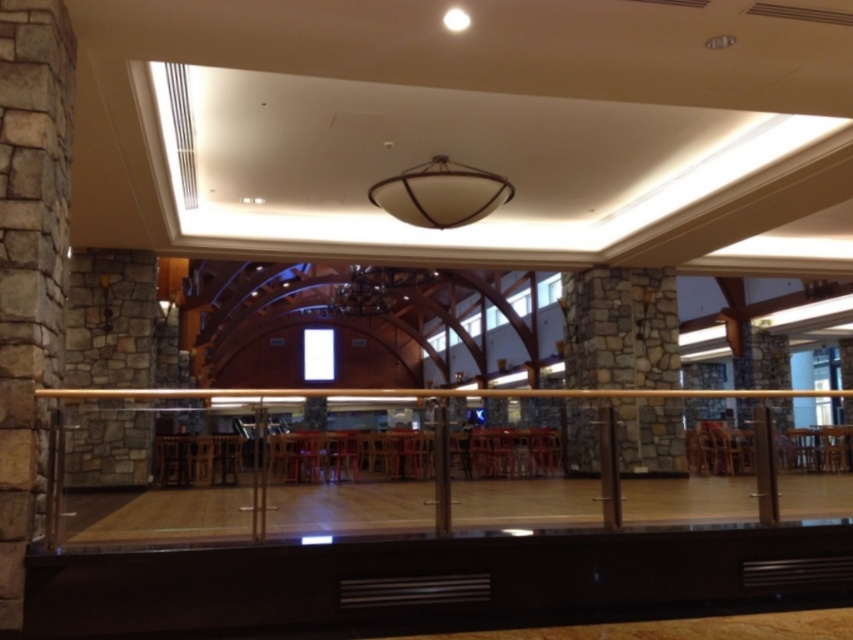
Question: Is satin gold railing at center bigger than stone textured pillar at left?

Choices:
 (A) yes
 (B) no

Answer: (B)

Question: Is satin gold railing at center to the left of stone textured pillar at left from the viewer's perspective?

Choices:
 (A) yes
 (B) no

Answer: (B)

Question: Can you confirm if satin gold railing at center is bigger than stone textured pillar at left?

Choices:
 (A) no
 (B) yes

Answer: (A)

Question: Which of the following is the farthest from the observer?

Choices:
 (A) satin gold railing at center
 (B) stone textured pillar at left

Answer: (A)